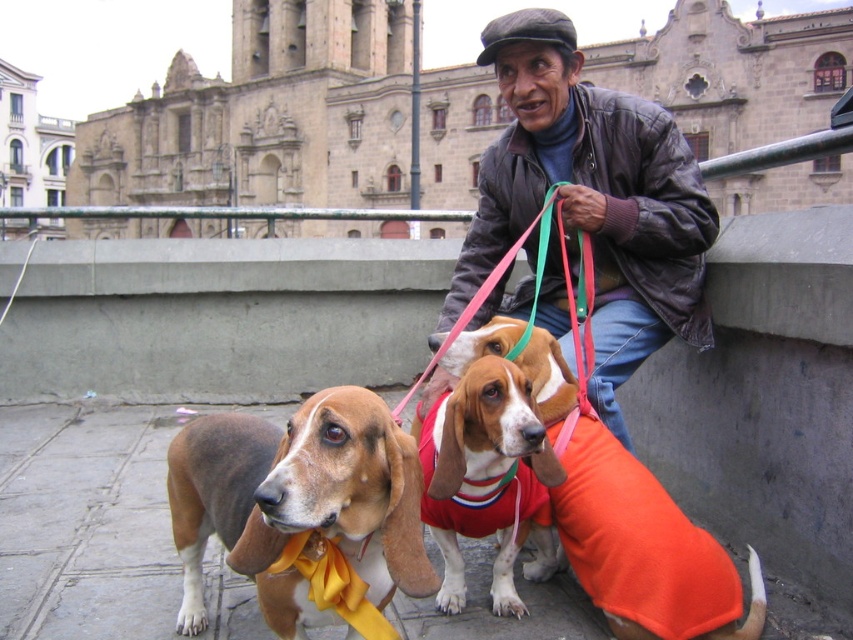
Question: Is brown soft fabric dog at center positioned before orange fleece sweater at center?

Choices:
 (A) no
 (B) yes

Answer: (B)

Question: Does leather jacket at center appear under orange fleece sweater at center?

Choices:
 (A) no
 (B) yes

Answer: (A)

Question: Can you confirm if leather jacket at center is bigger than brown and white fur at center?

Choices:
 (A) yes
 (B) no

Answer: (A)

Question: Which point is farther from the camera taking this photo?

Choices:
 (A) (341, 483)
 (B) (526, 467)

Answer: (B)

Question: Which object is farther from the camera taking this photo?

Choices:
 (A) brown soft fabric dog at center
 (B) orange fleece sweater at center
 (C) leather jacket at center
 (D) brown and white fur at center

Answer: (C)

Question: Which of these objects is positioned closest to the orange fleece sweater at center?

Choices:
 (A) brown soft fabric dog at center
 (B) leather jacket at center

Answer: (A)